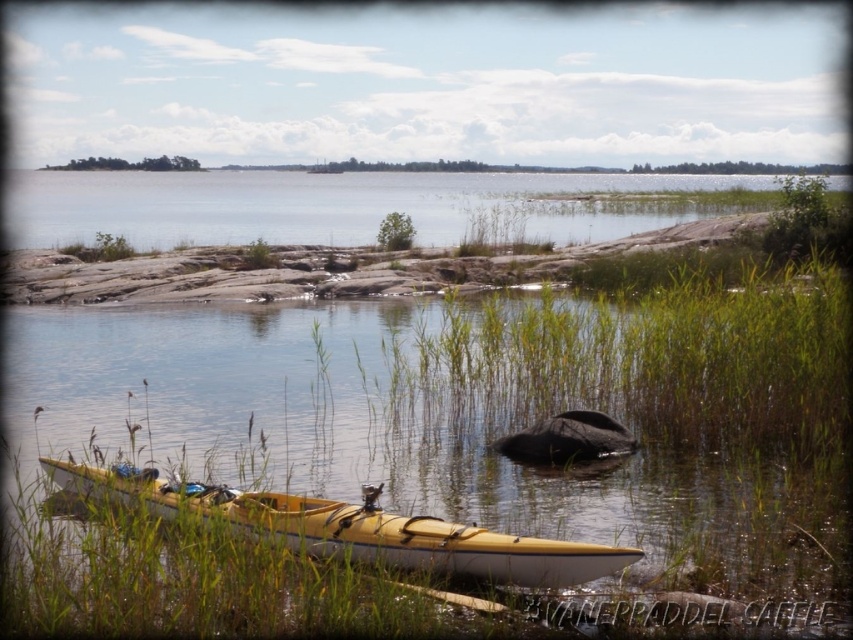
Is green grass at lower center thinner than clear water at center?

Indeed, green grass at lower center has a lesser width compared to clear water at center.

Which of these two, green grass at lower center or clear water at center, stands taller?

Answer: clear water at center

At what (x,y) coordinates should I click in order to perform the action: click on green grass at lower center. Please return your answer as a coordinate pair (x, y). This screenshot has width=853, height=640. Looking at the image, I should click on (433, 456).

I want to click on green grass at lower center, so click(433, 456).

Does green grass at lower center have a lesser width compared to yellow matte kayak at lower left?

In fact, green grass at lower center might be wider than yellow matte kayak at lower left.

Which is more to the right, green grass at lower center or yellow matte kayak at lower left?

yellow matte kayak at lower left is more to the right.

Between point (691, 506) and point (527, 586), which one is positioned in front?

Point (527, 586) is more forward.

At what (x,y) coordinates should I click in order to perform the action: click on green grass at lower center. Please return your answer as a coordinate pair (x, y). Image resolution: width=853 pixels, height=640 pixels. Looking at the image, I should click on (433, 456).

Is point (351, 240) positioned in front of point (498, 544)?

No.

Who is positioned more to the right, clear water at center or yellow matte kayak at lower left?

yellow matte kayak at lower left

Does point (169, 237) come farther from viewer compared to point (368, 545)?

That is True.

The height and width of the screenshot is (640, 853). I want to click on clear water at center, so click(x=339, y=205).